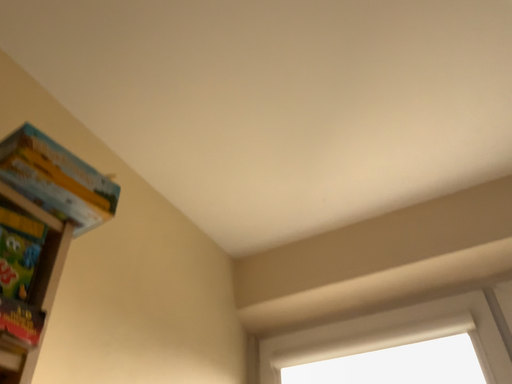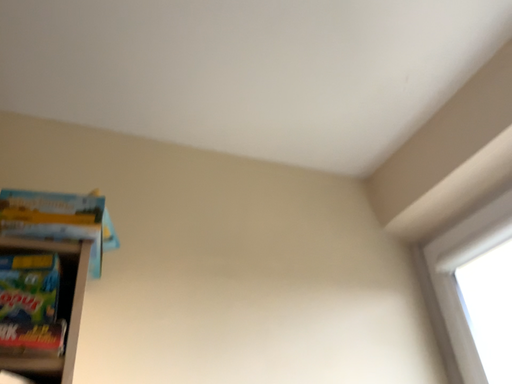
Question: Which way did the camera rotate in the video?

Choices:
 (A) rotated left
 (B) rotated right

Answer: (A)